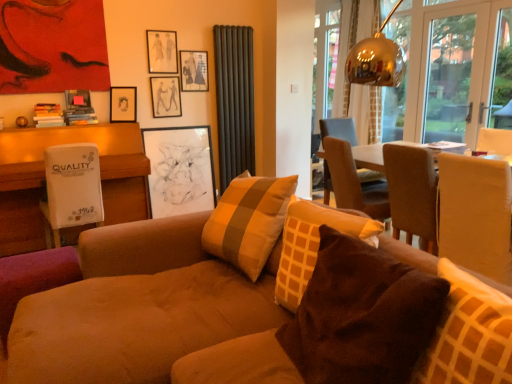
You are a GUI agent. You are given a task and a screenshot of the screen. Output one action in this format:
    pyautogui.click(x=<x>, y=<y>)
    Task: Click on the free spot above transparent glass door at upper right (from a real-world perspective)
    
    Given the screenshot: What is the action you would take?
    [449, 3]